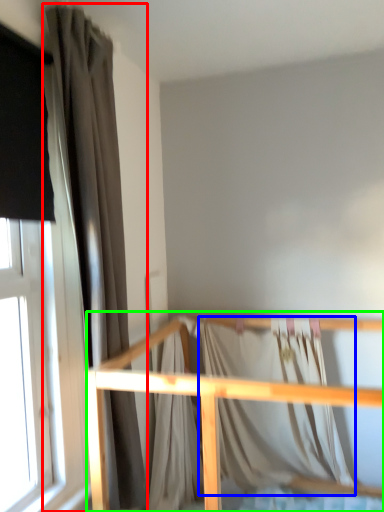
Question: Which is nearer to the curtain (highlighted by a red box)? blanket (highlighted by a blue box) or rail (highlighted by a green box).

Choices:
 (A) blanket
 (B) rail

Answer: (B)